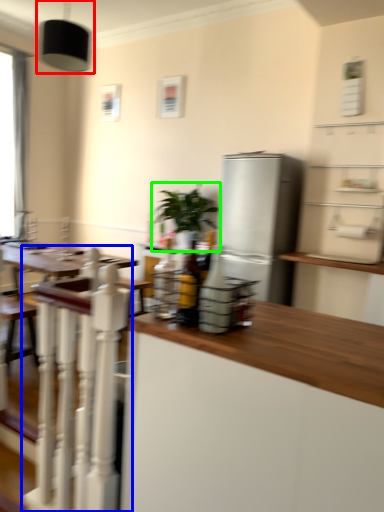
Question: Which object is the farthest from light fixture (highlighted by a red box)? Choose among these: rail (highlighted by a blue box) or houseplant (highlighted by a green box).

Choices:
 (A) rail
 (B) houseplant

Answer: (A)